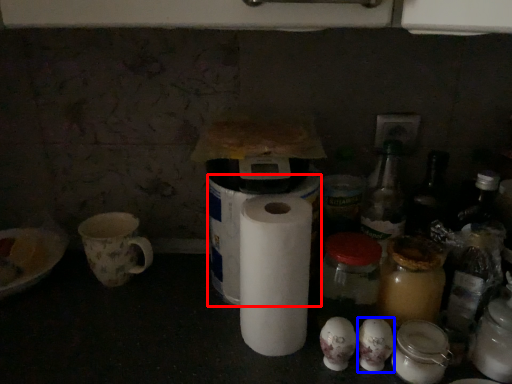
Question: Which of the following is the closest to the observer, toilet paper (highlighted by a red box) or toilet paper (highlighted by a blue box)?

Choices:
 (A) toilet paper
 (B) toilet paper

Answer: (B)